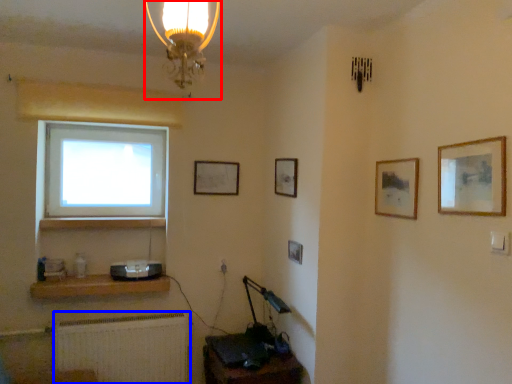
Question: Which of the following is the closest to the observer, lamp (highlighted by a red box) or radiator (highlighted by a blue box)?

Choices:
 (A) lamp
 (B) radiator

Answer: (A)